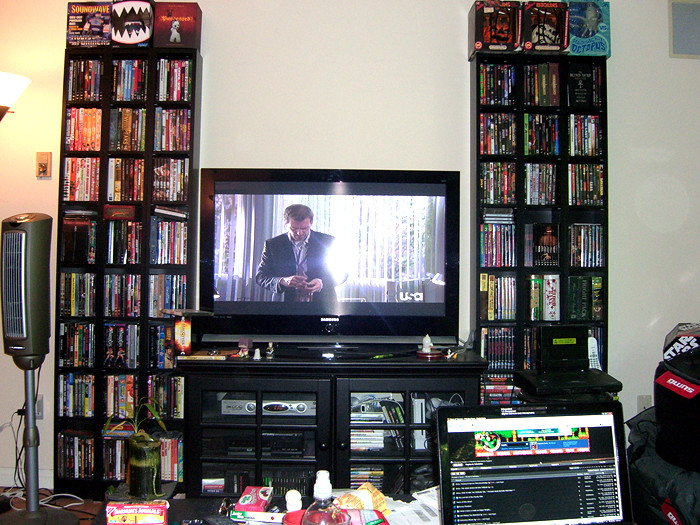
Where is `tv screen`? The height and width of the screenshot is (525, 700). tv screen is located at coordinates (365, 281).